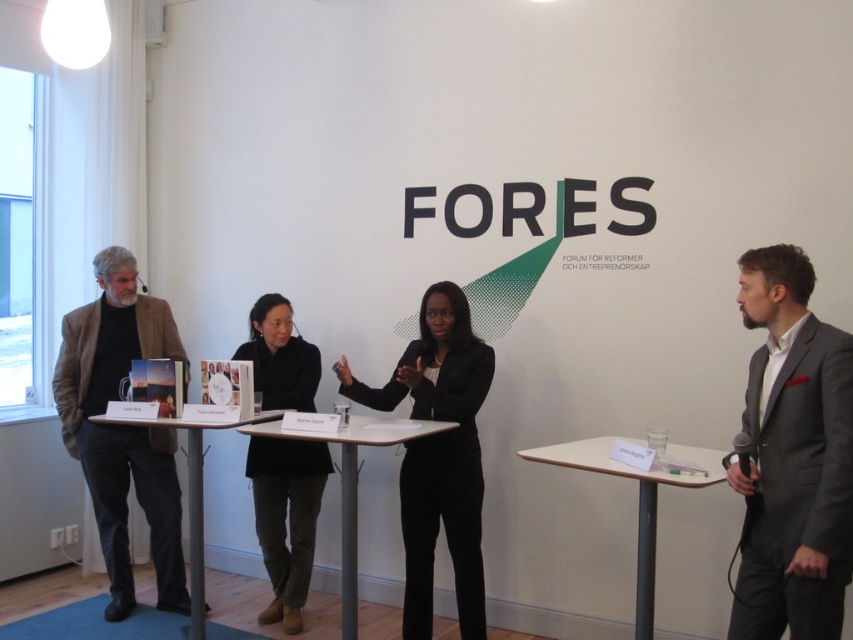
Question: Which object is the closest to the wooden table at center?

Choices:
 (A) light wood table at lower right
 (B) dark brown leather jacket at center

Answer: (B)

Question: Which of these objects is positioned closest to the brown woolen jacket at left?

Choices:
 (A) dark brown leather jacket at center
 (B) black matte suit at center

Answer: (A)

Question: Is gray suit at right bigger than wooden table at center?

Choices:
 (A) yes
 (B) no

Answer: (B)

Question: Considering the real-world distances, which object is farthest from the matte black table at center?

Choices:
 (A) brown woolen jacket at left
 (B) black matte suit at center
 (C) gray suit at right

Answer: (C)

Question: Can you confirm if gray suit at right is positioned above black matte suit at center?

Choices:
 (A) yes
 (B) no

Answer: (A)

Question: Does brown woolen jacket at left have a larger size compared to matte black table at center?

Choices:
 (A) no
 (B) yes

Answer: (A)